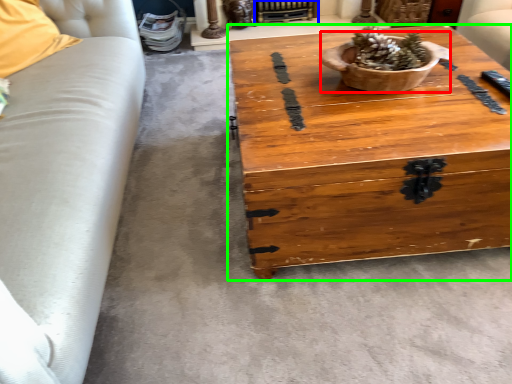
Question: Which object is the closest to the flowerpot (highlighted by a red box)? Choose among these: fireplace (highlighted by a blue box) or coffee table (highlighted by a green box).

Choices:
 (A) fireplace
 (B) coffee table

Answer: (B)